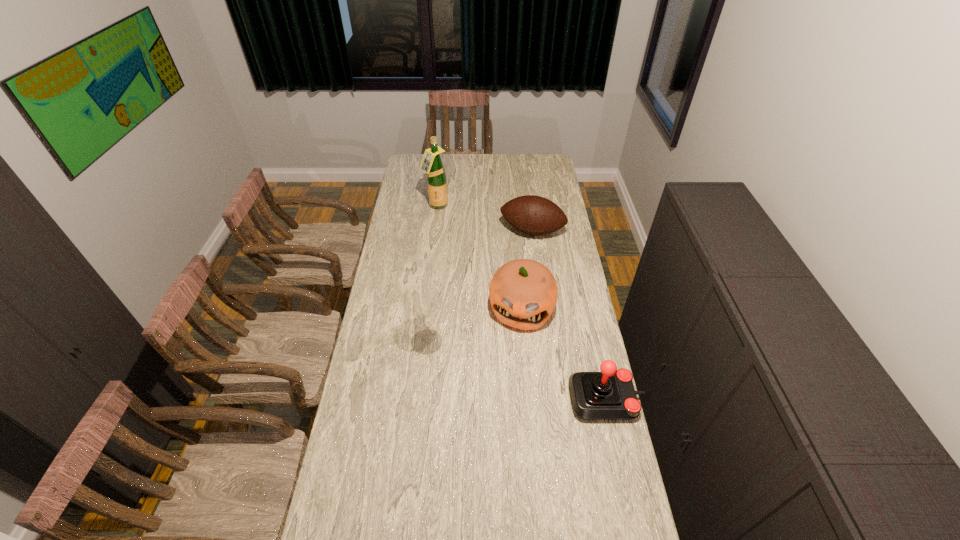
Find the location of a particular element. The height and width of the screenshot is (540, 960). vacant space on the desktop that is between the flute glass and the joystick and is positioned on the front-facing side of the farthest object is located at coordinates (507, 367).

This screenshot has height=540, width=960. Identify the location of vacant space on the desktop that is between the flute glass and the joystick and is positioned on the laces of the second farthest object. (492, 362).

At what (x,y) coordinates should I click in order to perform the action: click on vacant spot on the desktop that is between the flute glass and the nearest object and is positioned on the face of the pumpkin. Please return your answer as a coordinate pair (x, y). This screenshot has height=540, width=960. Looking at the image, I should click on (510, 368).